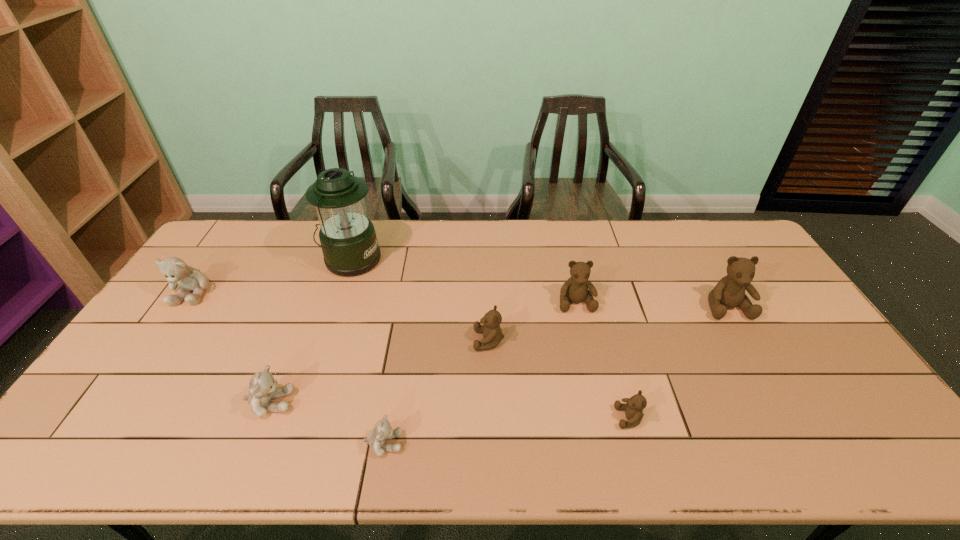
You are a GUI agent. You are given a task and a screenshot of the screen. Output one action in this format:
    pyautogui.click(x=<x>, y=<y>)
    Task: Click on the vacant area located on the front-facing side of the fourth farthest teddy bear
    The width and height of the screenshot is (960, 540).
    Given the screenshot: What is the action you would take?
    (x=341, y=340)

Where is `vacant space located on the face of the second farthest gray teddy bear`? The height and width of the screenshot is (540, 960). vacant space located on the face of the second farthest gray teddy bear is located at coordinates (381, 403).

This screenshot has width=960, height=540. I want to click on vacant region located on the front-facing side of the nearest brown teddy bear, so click(465, 418).

Where is `vacant space located 0.320m on the front-facing side of the nearest brown teddy bear`? This screenshot has height=540, width=960. vacant space located 0.320m on the front-facing side of the nearest brown teddy bear is located at coordinates (486, 418).

The height and width of the screenshot is (540, 960). Identify the location of free space located on the front-facing side of the nearest brown teddy bear. (583, 418).

At what (x,y) coordinates should I click in order to perform the action: click on vacant point located on the face of the smallest gray teddy bear. Please return your answer as a coordinate pair (x, y). Looking at the image, I should click on coord(535,443).

At what (x,y) coordinates should I click in order to perform the action: click on object positioned at the far edge. Please return your answer as a coordinate pair (x, y). The height and width of the screenshot is (540, 960). Looking at the image, I should click on (348, 239).

This screenshot has height=540, width=960. Identify the location of object present at the left edge. (177, 272).

The width and height of the screenshot is (960, 540). I want to click on object that is at the right edge, so click(x=729, y=292).

Where is `vacant space at the far edge of the desktop`? This screenshot has height=540, width=960. vacant space at the far edge of the desktop is located at coordinates (458, 221).